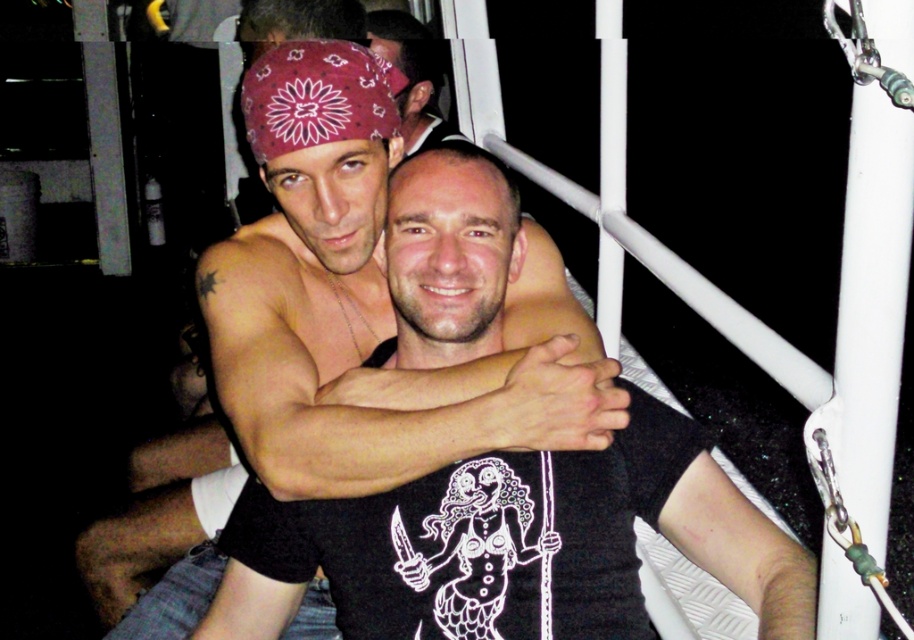
Who is more forward, (296, 500) or (410, 132)?

Point (296, 500) is in front.

Looking at this image, does matte black shirt at center have a greater width compared to matte black bandana at upper center?

Yes, matte black shirt at center is wider than matte black bandana at upper center.

Which is behind, point (487, 625) or point (375, 35)?

The point (375, 35) is behind.

Identify the location of matte black shirt at center. tap(512, 545).